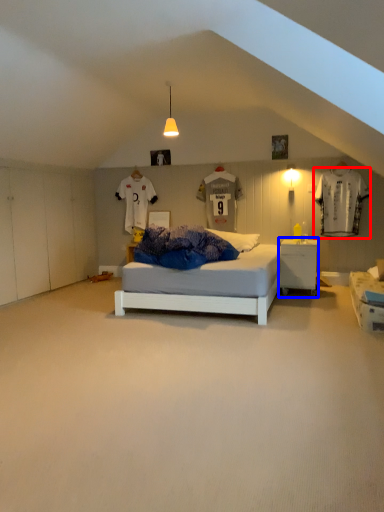
Question: Among these objects, which one is nearest to the camera, laundry (highlighted by a red box) or nightstand (highlighted by a blue box)?

Choices:
 (A) laundry
 (B) nightstand

Answer: (B)